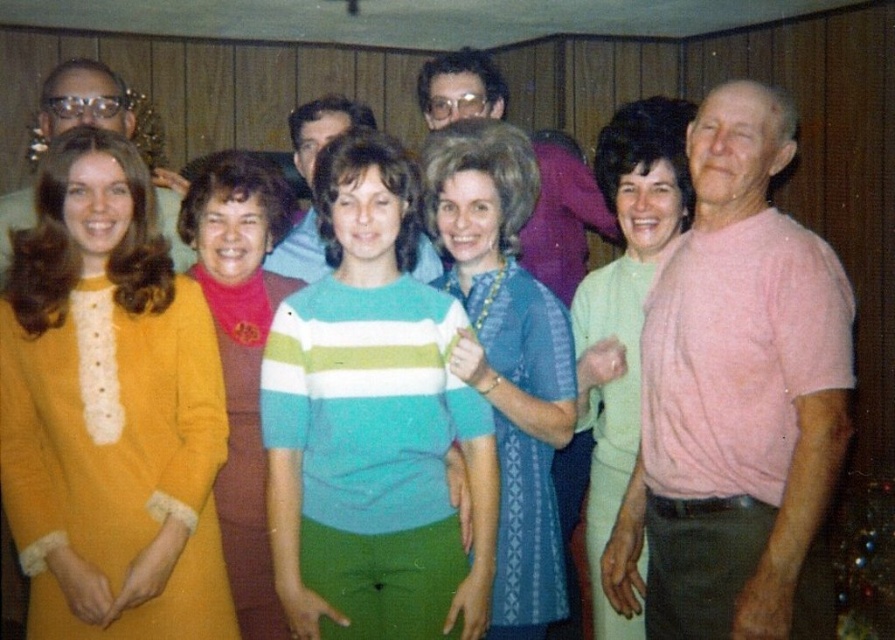
Question: Does blue textured dress at center have a lesser width compared to matte pink shirt at center?

Choices:
 (A) no
 (B) yes

Answer: (B)

Question: Among these points, which one is farthest from the camera?

Choices:
 (A) (348, 100)
 (B) (777, 515)
 (C) (506, 138)

Answer: (A)

Question: Which object appears farthest from the camera in this image?

Choices:
 (A) matte orange dress at center
 (B) matte yellow dress at left
 (C) matte pink shirt at center

Answer: (C)

Question: Is the position of matte pink shirt at center less distant than that of matte blue shirt at center?

Choices:
 (A) no
 (B) yes

Answer: (A)

Question: Which point appears farthest from the camera in this image?

Choices:
 (A) (479, 307)
 (B) (597, 513)
 (C) (175, 394)
 (D) (537, 250)

Answer: (D)

Question: Is light green sweater at center below matte pink shirt at center?

Choices:
 (A) yes
 (B) no

Answer: (A)